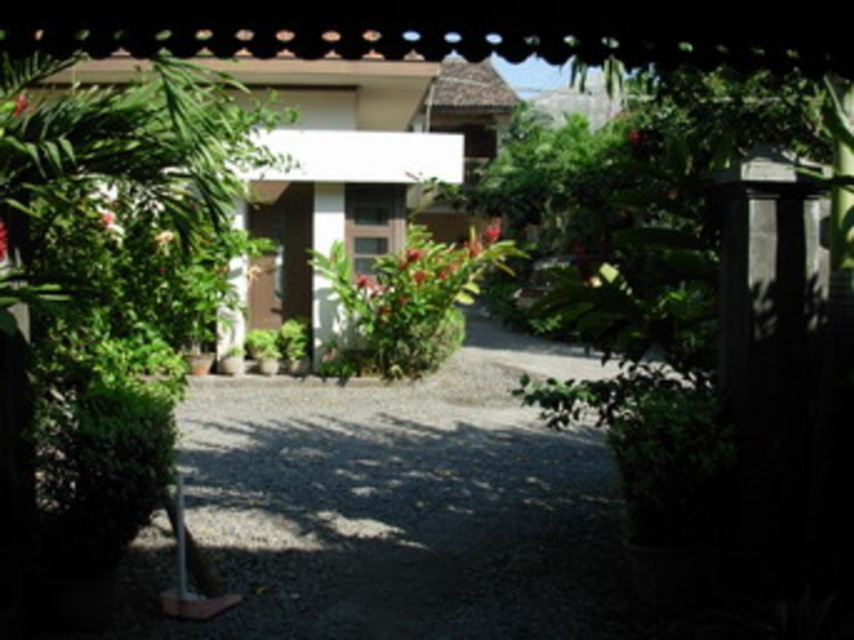
How far apart are green leafy plant at left and green leafy bush at center?

A distance of 7.89 meters exists between green leafy plant at left and green leafy bush at center.

Which is in front, point (61, 182) or point (378, 298)?

Positioned in front is point (61, 182).

I want to click on green leafy plant at left, so click(x=91, y=291).